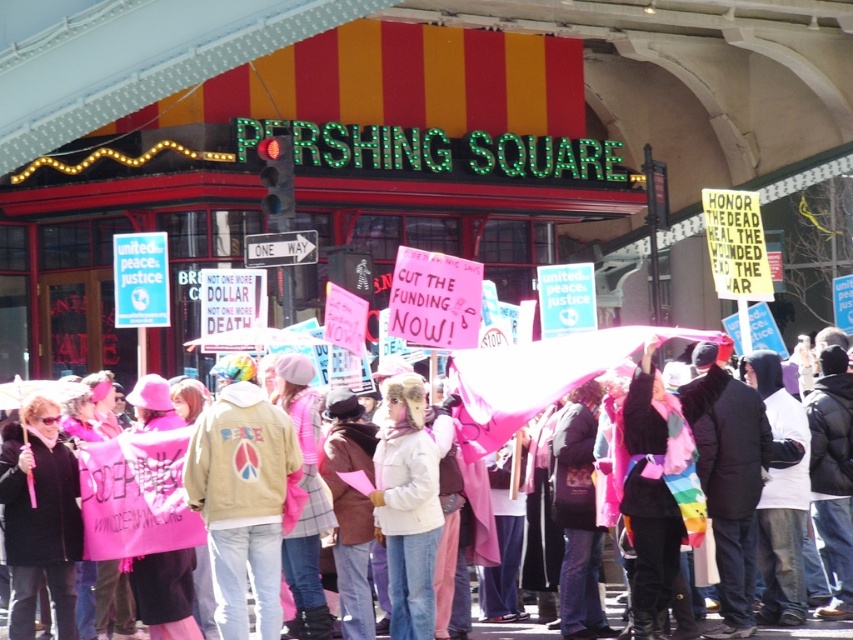
You are a photographer standing at the edge of Pershing Square, where the protest is taking place. You want to capture a closeup shot of the tan leather jacket at center. Given that your telephoto lens has a maximum effective range of 100 feet, will you be able to take the photo without moving closer?

The tan leather jacket at center is 142.37 feet away from the viewer, which exceeds the telephoto lens maximum effective range of 100 feet. Therefore, you cannot take the closeup shot without moving closer.

From the picture: You are a photographer at Pershing Square capturing the protest scene. You want to focus your camera on the tan leather jacket at center. What are the coordinates you should set in your camera to ensure the jacket is centered in the frame?

The coordinates for the tan leather jacket at center are at point (242, 496), so you should set your camera to focus at those coordinates to center the jacket in the frame.

You are a photographer at Pershing Square, and you want to capture both the point at (x=393, y=513) and the point at (x=486, y=380) in your photo. Which point should you focus on first to ensure both are in frame?

You should focus on the point at (x=393, y=513) first because it is in front of the point at (x=486, y=380), so capturing it first ensures both are within the frame.